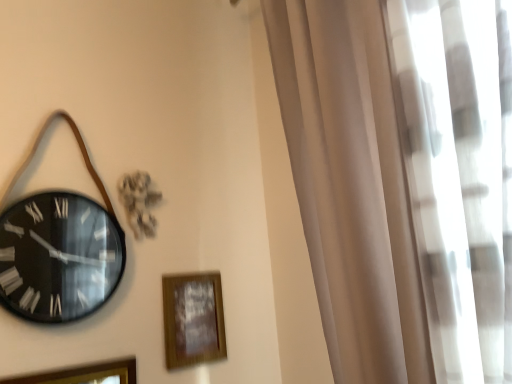
Question: From the image's perspective, is wooden picture frame at lower center, which is the 2th picture frame in front-to-back order, above wooden picture frame at lower left, acting as the first picture frame starting from the front?

Choices:
 (A) yes
 (B) no

Answer: (A)

Question: From a real-world perspective, is wooden picture frame at lower center, arranged as the first picture frame when viewed from the right, physically above wooden picture frame at lower left, acting as the first picture frame starting from the front?

Choices:
 (A) yes
 (B) no

Answer: (A)

Question: Is wooden picture frame at lower center, which appears as the 2th picture frame when viewed from the left, not near wooden picture frame at lower left, acting as the first picture frame starting from the front?

Choices:
 (A) no
 (B) yes

Answer: (A)

Question: Does wooden picture frame at lower center, which appears as the 2th picture frame when viewed from the left, lie behind wooden picture frame at lower left, acting as the 1th picture frame starting from the left?

Choices:
 (A) yes
 (B) no

Answer: (A)

Question: Is wooden picture frame at lower center, which appears as the 2th picture frame when viewed from the left, turned away from wooden picture frame at lower left, the second picture frame positioned from the back?

Choices:
 (A) no
 (B) yes

Answer: (A)

Question: From a real-world perspective, is wooden picture frame at lower left, the second picture frame positioned from the back, physically located above or below black glass clock at left?

Choices:
 (A) below
 (B) above

Answer: (A)

Question: Is wooden picture frame at lower left, acting as the 1th picture frame starting from the left, in front of or behind black glass clock at left in the image?

Choices:
 (A) behind
 (B) front

Answer: (B)

Question: From the image's perspective, relative to black glass clock at left, is wooden picture frame at lower left, acting as the 1th picture frame starting from the left, above or below?

Choices:
 (A) below
 (B) above

Answer: (A)

Question: In terms of size, does wooden picture frame at lower left, the second picture frame positioned from the back, appear bigger or smaller than black glass clock at left?

Choices:
 (A) big
 (B) small

Answer: (B)

Question: From a real-world perspective, relative to wooden picture frame at lower left, acting as the 1th picture frame starting from the left, is black glass clock at left vertically above or below?

Choices:
 (A) below
 (B) above

Answer: (B)

Question: Choose the correct answer: Is black glass clock at left inside wooden picture frame at lower left, the second picture frame positioned from the back, or outside it?

Choices:
 (A) outside
 (B) inside

Answer: (A)

Question: Is point (91, 200) closer or farther from the camera than point (83, 380)?

Choices:
 (A) farther
 (B) closer

Answer: (A)

Question: In terms of width, does black glass clock at left look wider or thinner when compared to wooden picture frame at lower left, acting as the first picture frame starting from the front?

Choices:
 (A) thin
 (B) wide

Answer: (B)

Question: Which is correct: black glass clock at left is inside wooden picture frame at lower center, which appears as the 2th picture frame when viewed from the left, or outside of it?

Choices:
 (A) outside
 (B) inside

Answer: (A)

Question: Considering the positions of black glass clock at left and wooden picture frame at lower center, which is the 2th picture frame in front-to-back order, in the image, is black glass clock at left wider or thinner than wooden picture frame at lower center, which is the 2th picture frame in front-to-back order,?

Choices:
 (A) wide
 (B) thin

Answer: (A)